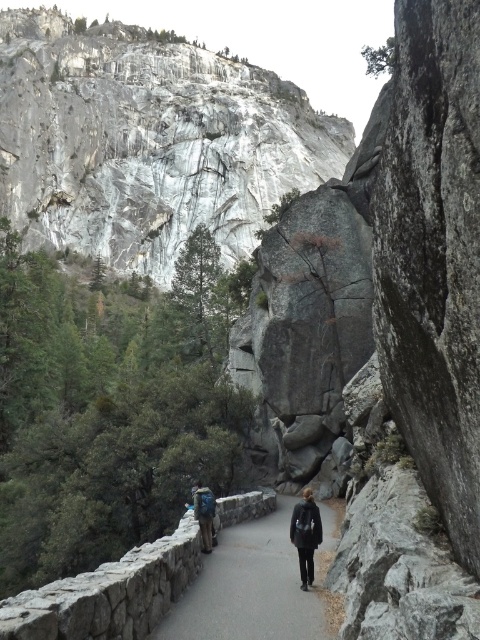
Question: Among these points, which one is nearest to the camera?

Choices:
 (A) (212, 525)
 (B) (261, 100)

Answer: (A)

Question: Which point is closer to the camera?

Choices:
 (A) white marble mountain at upper center
 (B) dark gray asphalt path at center
 (C) black matte jacket at center
 (D) blue fabric backpack at center

Answer: (B)

Question: Can you confirm if white marble mountain at upper center is wider than black matte jacket at center?

Choices:
 (A) yes
 (B) no

Answer: (A)

Question: From the image, what is the correct spatial relationship of dark gray asphalt path at center in relation to black matte jacket at center?

Choices:
 (A) above
 (B) below

Answer: (B)

Question: Considering the relative positions of dark gray asphalt path at center and blue fabric backpack at center in the image provided, where is dark gray asphalt path at center located with respect to blue fabric backpack at center?

Choices:
 (A) above
 (B) below

Answer: (B)

Question: Based on their relative distances, which object is nearer to the dark gray asphalt path at center?

Choices:
 (A) white marble mountain at upper center
 (B) black matte jacket at center
 (C) blue fabric backpack at center

Answer: (B)